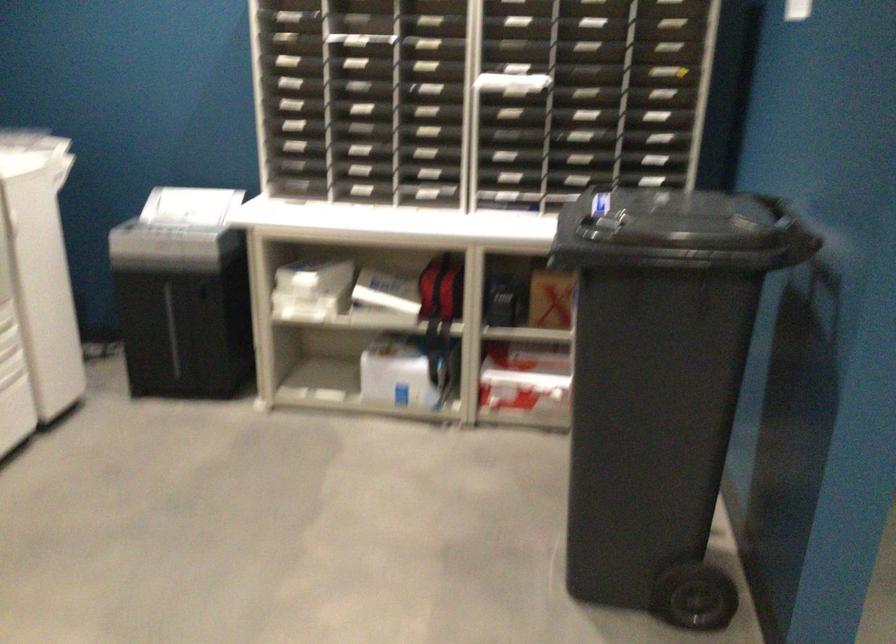
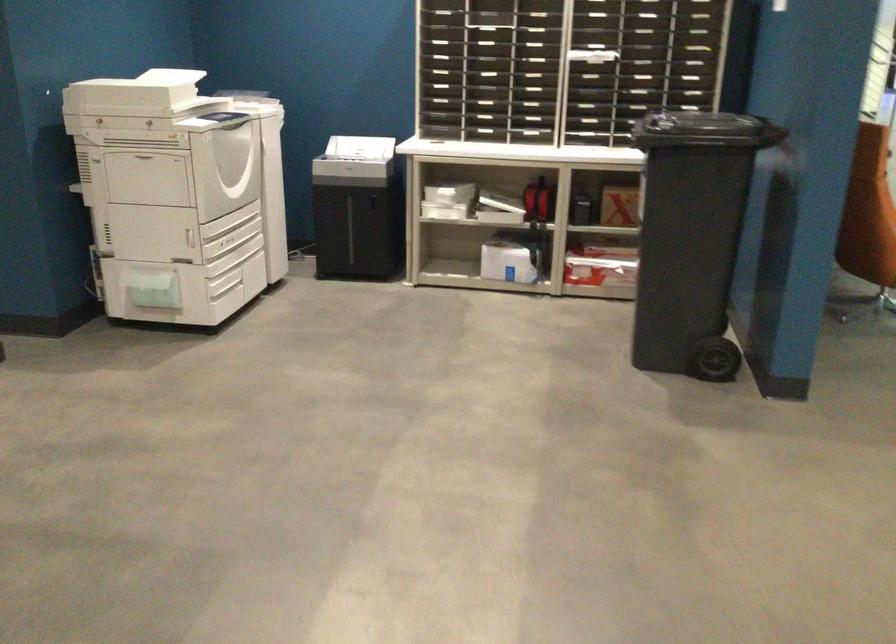
Question: In a continuous first-person perspective shot, in which direction is the camera moving?

Choices:
 (A) Left
 (B) Right
 (C) Forward
 (D) Backward

Answer: (D)